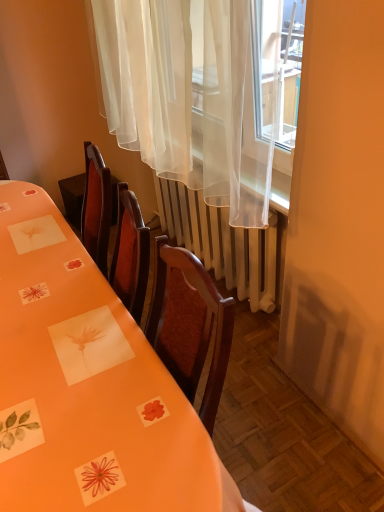
Question: Can you confirm if white metallic radiator at center is smaller than orange paper table at center?

Choices:
 (A) yes
 (B) no

Answer: (A)

Question: Is white metallic radiator at center looking in the opposite direction of orange paper table at center?

Choices:
 (A) yes
 (B) no

Answer: (B)

Question: From the image's perspective, is white metallic radiator at center on orange paper table at center?

Choices:
 (A) yes
 (B) no

Answer: (A)

Question: Considering the relative sizes of white metallic radiator at center and orange paper table at center in the image provided, is white metallic radiator at center shorter than orange paper table at center?

Choices:
 (A) yes
 (B) no

Answer: (A)

Question: Is white metallic radiator at center further to camera compared to orange paper table at center?

Choices:
 (A) yes
 (B) no

Answer: (A)

Question: Looking at the image, does white metallic radiator at center seem bigger or smaller compared to orange paper table at center?

Choices:
 (A) small
 (B) big

Answer: (A)

Question: From a real-world perspective, is white metallic radiator at center above or below orange paper table at center?

Choices:
 (A) above
 (B) below

Answer: (B)

Question: Would you say white metallic radiator at center is to the left or to the right of orange paper table at center in the picture?

Choices:
 (A) right
 (B) left

Answer: (A)

Question: From the image's perspective, is white metallic radiator at center located above or below orange paper table at center?

Choices:
 (A) below
 (B) above

Answer: (B)

Question: Is sheer white curtain at upper center to the left or to the right of white metallic radiator at center in the image?

Choices:
 (A) right
 (B) left

Answer: (B)

Question: Is sheer white curtain at upper center inside or outside of white metallic radiator at center?

Choices:
 (A) inside
 (B) outside

Answer: (B)

Question: Looking at the image, does sheer white curtain at upper center seem bigger or smaller compared to white metallic radiator at center?

Choices:
 (A) small
 (B) big

Answer: (B)

Question: Looking at their shapes, would you say sheer white curtain at upper center is wider or thinner than white metallic radiator at center?

Choices:
 (A) wide
 (B) thin

Answer: (A)

Question: Would you say white metallic radiator at center is to the left or to the right of sheer white curtain at upper center in the picture?

Choices:
 (A) left
 (B) right

Answer: (B)

Question: Is white metallic radiator at center bigger or smaller than sheer white curtain at upper center?

Choices:
 (A) big
 (B) small

Answer: (B)